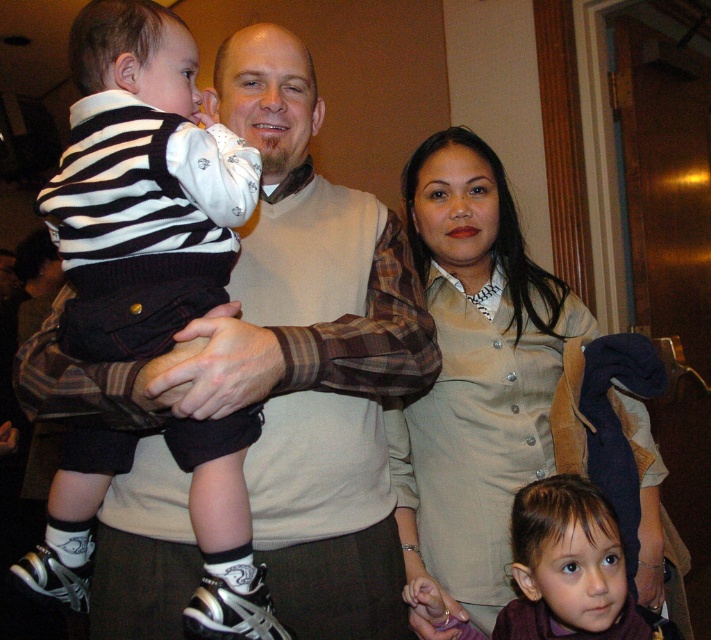
Question: Which object is the farthest from the striped knit sweater at center?

Choices:
 (A) brown matte hair at lower right
 (B) matte beige dress at center

Answer: (A)

Question: Is striped knit sweater at center positioned at the back of matte beige dress at center?

Choices:
 (A) yes
 (B) no

Answer: (B)

Question: Which object is closer to the camera taking this photo?

Choices:
 (A) matte beige dress at center
 (B) striped knit sweater at center
 (C) brown matte hair at lower right

Answer: (B)

Question: Does matte beige dress at center lie behind brown matte hair at lower right?

Choices:
 (A) yes
 (B) no

Answer: (A)

Question: Considering the real-world distances, which object is closest to the striped knit sweater at center?

Choices:
 (A) brown matte hair at lower right
 (B) matte beige dress at center

Answer: (B)

Question: Is striped knit sweater at center wider than brown matte hair at lower right?

Choices:
 (A) no
 (B) yes

Answer: (B)